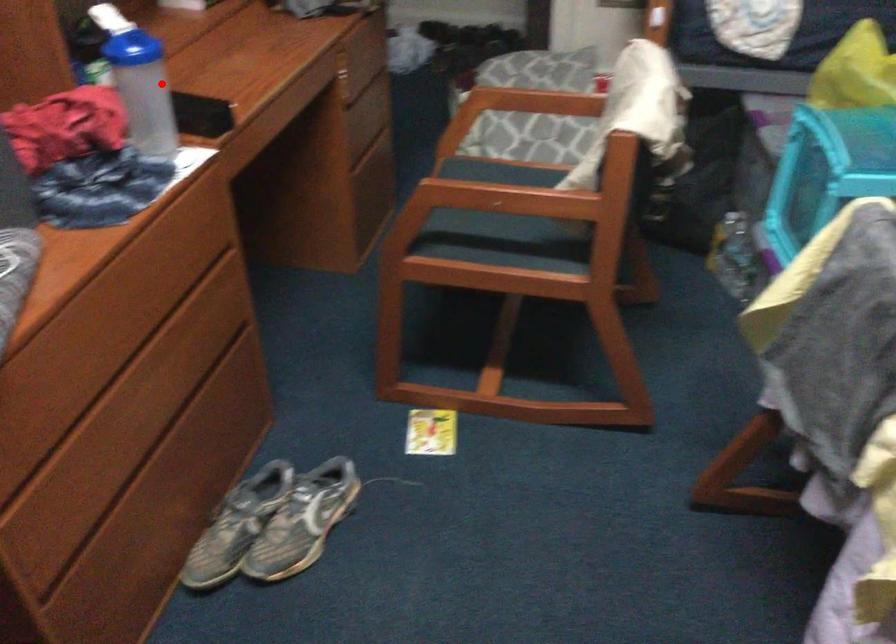
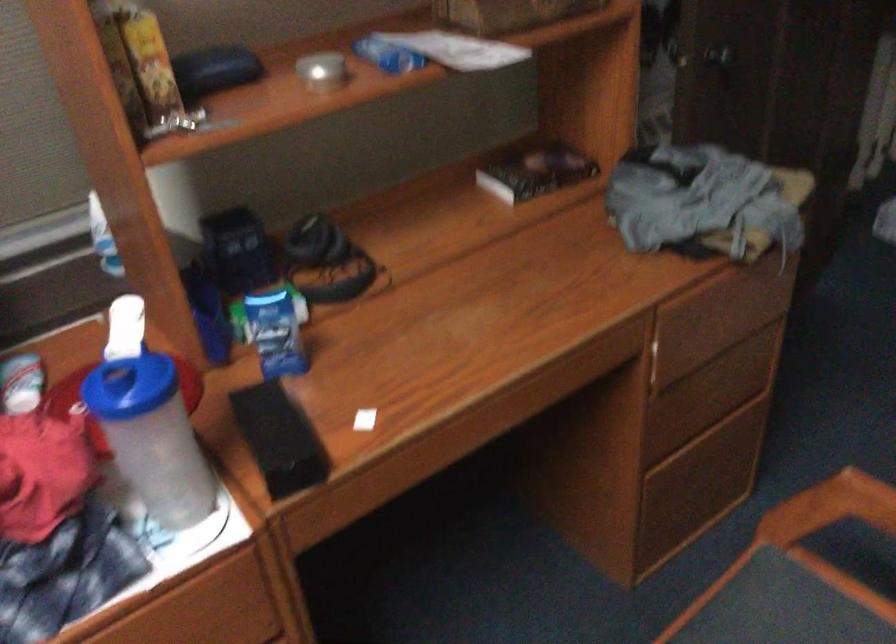
Locate, in the second image, the point that corresponds to the highlighted location in the first image.

(151, 437)